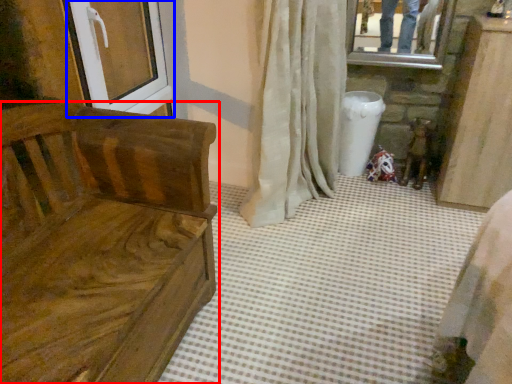
Question: Which point is further to the camera, furniture (highlighted by a red box) or screen door (highlighted by a blue box)?

Choices:
 (A) furniture
 (B) screen door

Answer: (B)